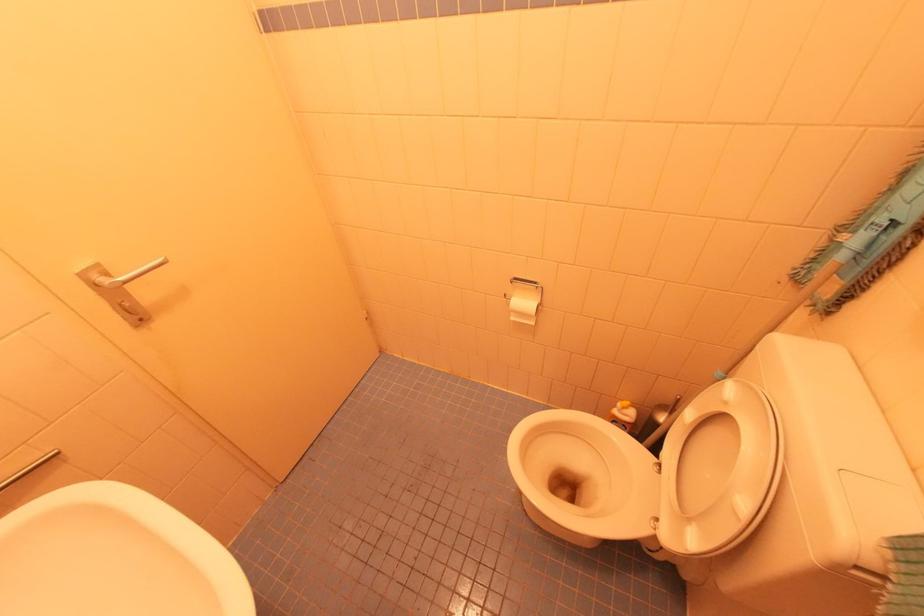
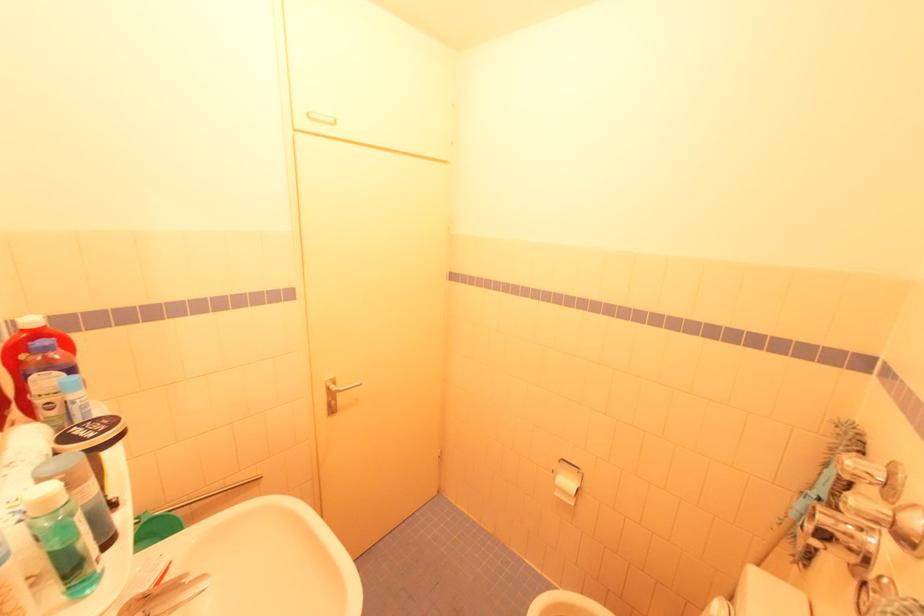
The images are taken continuously from a first-person perspective. In which direction is your viewpoint rotating?

The camera rotated toward left-up.